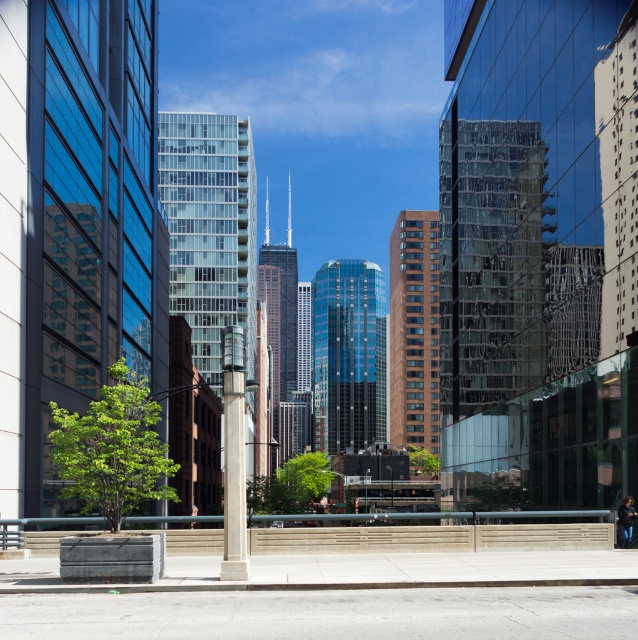
What do you see at coordinates (346, 355) in the screenshot? The height and width of the screenshot is (640, 638). I see `shiny glass skyscraper at center` at bounding box center [346, 355].

Does point (353, 289) come closer to viewer compared to point (406, 248)?

No, (353, 289) is further to viewer.

Is point (325, 428) farther from camera compared to point (413, 240)?

Yes, it is.

This screenshot has height=640, width=638. I want to click on shiny glass skyscraper at center, so click(346, 355).

Does transparent glass building at center have a lesser width compared to shiny glass skyscraper at center?

Correct, transparent glass building at center's width is less than shiny glass skyscraper at center's.

Can you confirm if transparent glass building at center is shorter than shiny glass skyscraper at center?

Yes, transparent glass building at center is shorter than shiny glass skyscraper at center.

Image resolution: width=638 pixels, height=640 pixels. What are the coordinates of `transparent glass building at center` in the screenshot? It's located at (491, 262).

Can you confirm if glassy reflective skyscraper at left is positioned to the left of brown glass skyscraper at center?

No, glassy reflective skyscraper at left is not to the left of brown glass skyscraper at center.

Does glassy reflective skyscraper at left appear on the right side of brown glass skyscraper at center?

Indeed, glassy reflective skyscraper at left is positioned on the right side of brown glass skyscraper at center.

At what (x,y) coordinates should I click in order to perform the action: click on glassy reflective skyscraper at left. Please return your answer as a coordinate pair (x, y). This screenshot has height=640, width=638. Looking at the image, I should click on (77, 221).